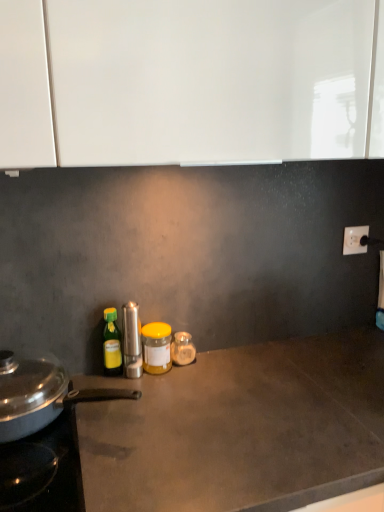
What are the coordinates of `free location in front of satin silver pepper mill at center, the 2th kitchen appliance in the left-to-right sequence` in the screenshot? It's located at (129, 411).